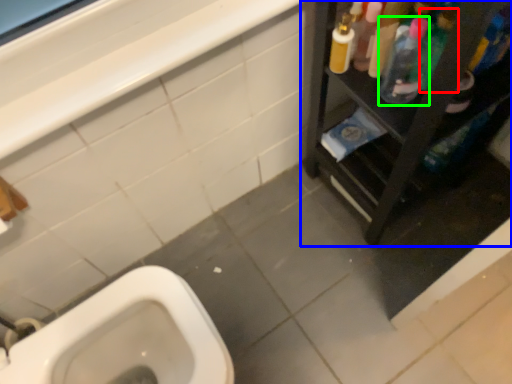
Question: Based on their relative distances, which object is nearer to cleaning product (highlighted by a red box)? Choose from furniture (highlighted by a blue box) and cleaning product (highlighted by a green box).

Choices:
 (A) furniture
 (B) cleaning product

Answer: (B)